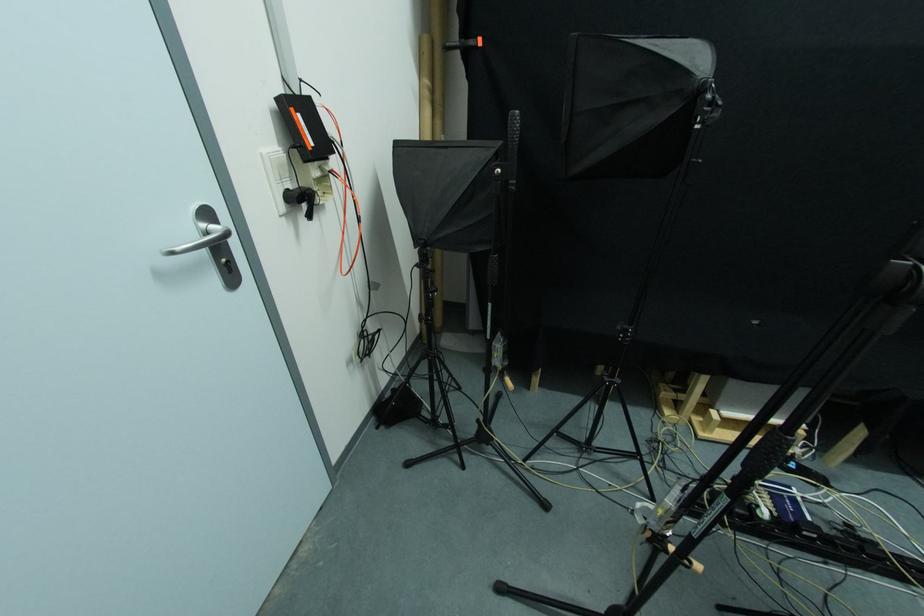
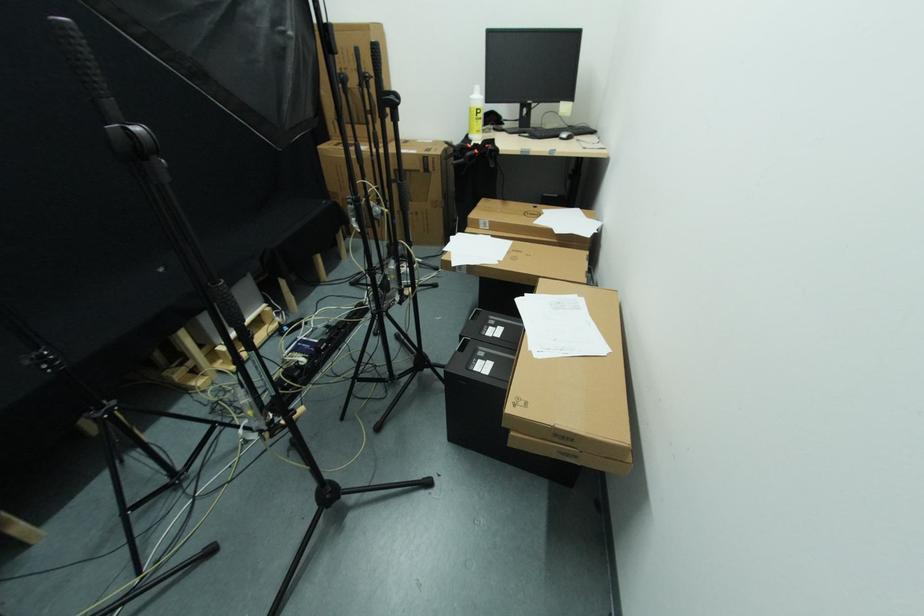
Based on the continuous images, in which direction is the camera rotating?

The camera rotated toward right-down.